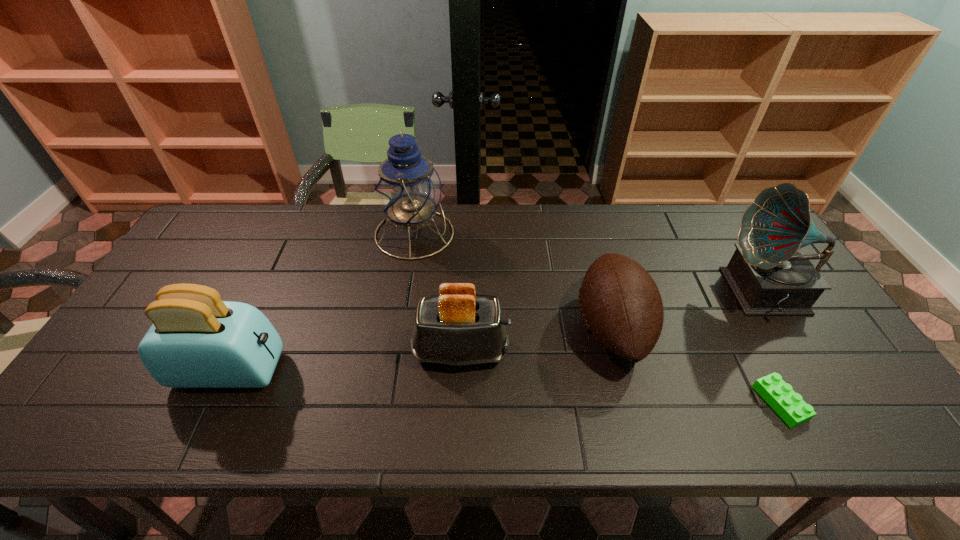
At what (x,y) coordinates should I click in order to perform the action: click on object present at the right edge. Please return your answer as a coordinate pair (x, y). The image size is (960, 540). Looking at the image, I should click on (769, 274).

This screenshot has height=540, width=960. I want to click on free space at the far edge, so click(x=377, y=224).

This screenshot has height=540, width=960. I want to click on free space at the near edge of the desktop, so [x=782, y=428].

In the image, there is a desktop. At what (x,y) coordinates should I click in order to perform the action: click on vacant area at the left edge. Please return your answer as a coordinate pair (x, y). Looking at the image, I should click on (190, 274).

Where is `free space at the right edge of the desktop`? free space at the right edge of the desktop is located at coordinates (861, 403).

Find the location of `blank space at the far left corner of the desktop`. blank space at the far left corner of the desktop is located at coordinates (228, 249).

In the image, there is a desktop. Identify the location of vacant space at the near left corner. (136, 406).

What are the coordinates of `vacant space at the near right corner` in the screenshot? It's located at (831, 408).

Where is `free point between the fourth object from left to right and the farthest object`? free point between the fourth object from left to right and the farthest object is located at coordinates (514, 281).

At what (x,y) coordinates should I click in order to perform the action: click on vacant area that lies between the right toaster and the taller toaster. Please return your answer as a coordinate pair (x, y). The height and width of the screenshot is (540, 960). Looking at the image, I should click on (346, 361).